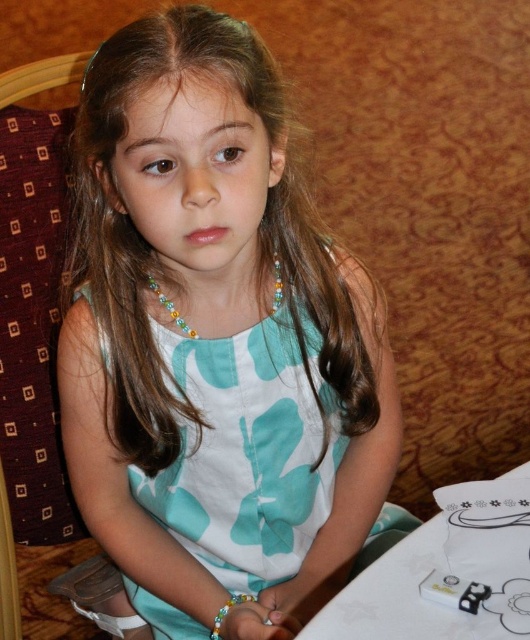
Question: Which object is the closest to the matte teal dress at center?

Choices:
 (A) white paper at lower right
 (B) multicolored beaded necklace at center
 (C) multicolored beaded bracelet at lower center

Answer: (B)

Question: Which point is closer to the camera?

Choices:
 (A) multicolored beaded necklace at center
 (B) matte teal dress at center
 (C) white paper at lower right

Answer: (B)

Question: Observing the image, what is the correct spatial positioning of matte teal dress at center in reference to multicolored beaded necklace at center?

Choices:
 (A) left
 (B) right

Answer: (A)

Question: Is matte teal dress at center above white paper at lower right?

Choices:
 (A) yes
 (B) no

Answer: (A)

Question: Is matte teal dress at center smaller than white paper at lower right?

Choices:
 (A) no
 (B) yes

Answer: (A)

Question: Which is nearer to the multicolored beaded necklace at center?

Choices:
 (A) matte teal dress at center
 (B) white paper at lower right

Answer: (A)